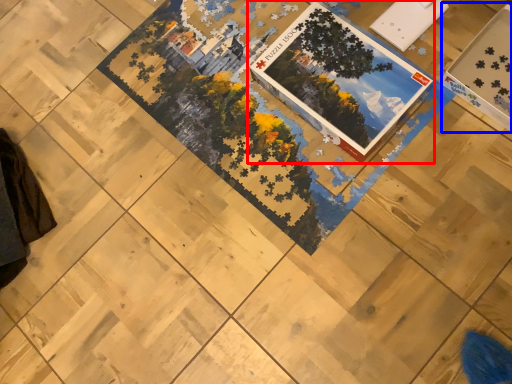
Question: Which object appears farthest to the camera in this image, book (highlighted by a red box) or square (highlighted by a blue box)?

Choices:
 (A) book
 (B) square

Answer: (A)